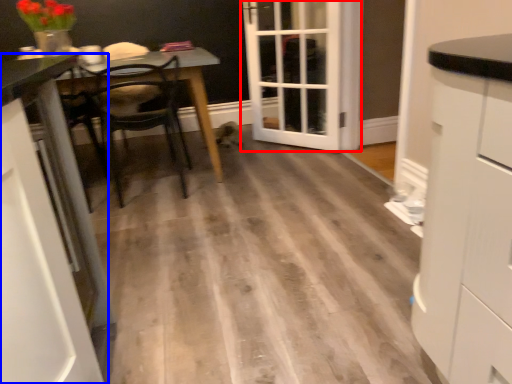
Question: Among these objects, which one is farthest to the camera, door (highlighted by a red box) or cabinetry (highlighted by a blue box)?

Choices:
 (A) door
 (B) cabinetry

Answer: (A)